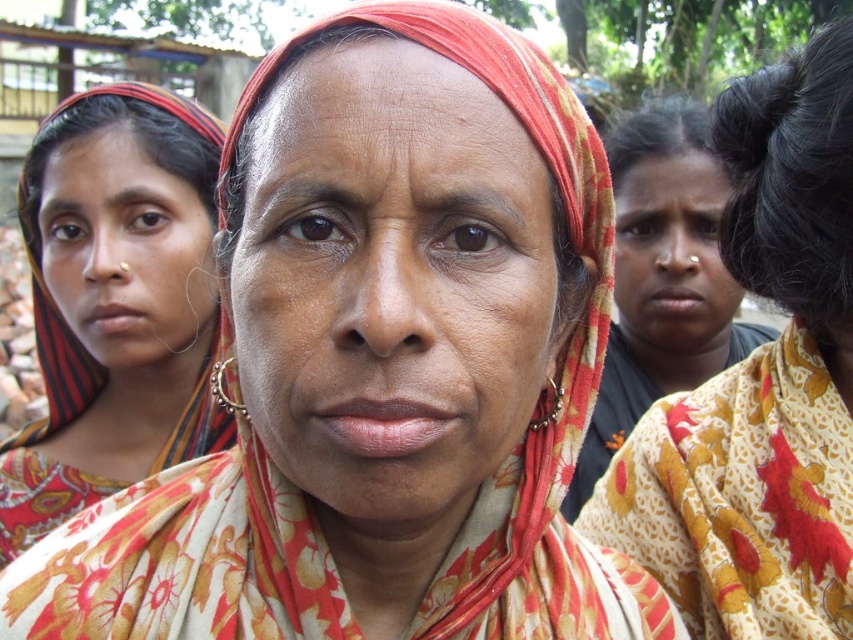
You are a photographer standing 30 inches away from a subject. You want to take a closeup shot of the floral fabric scarf at center. Is the current distance sufficient for a clear closeup?

The floral fabric scarf at center is 32.02 inches away from the viewer. Since the photographer is only 30 inches away, they are closer than the scarf, so the distance is sufficient for a clear closeup.

In the image, there is a matte floral scarf at center. Where exactly is it located in the image?

The matte floral scarf at center is located at point coordinates of [392,282].

You are an artist trying to paint this scene. You want to ensure the proportions between the matte floral scarf at center and the matte black saree at left are accurate. Which object should you paint smaller?

The matte floral scarf at center should be painted smaller because it occupies less space than the matte black saree at left.